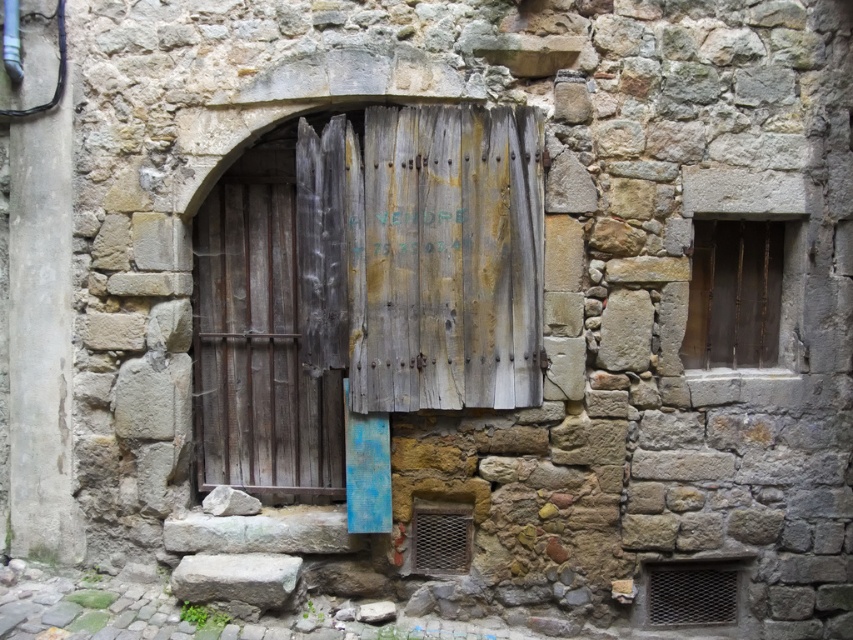
Question: Is wooden bars at right to the right of gray rough stone at lower left from the viewer's perspective?

Choices:
 (A) no
 (B) yes

Answer: (B)

Question: Is weathered wood door at center thinner than wooden bars at right?

Choices:
 (A) no
 (B) yes

Answer: (A)

Question: Is weathered wood shutter at center smaller than wooden bars at right?

Choices:
 (A) yes
 (B) no

Answer: (B)

Question: Which of the following is the closest to the observer?

Choices:
 (A) (727, 576)
 (B) (207, 579)
 (C) (751, 336)
 (D) (410, 257)

Answer: (D)

Question: Among these points, which one is nearest to the camera?

Choices:
 (A) (416, 204)
 (B) (267, 596)
 (C) (305, 497)

Answer: (A)

Question: Among these objects, which one is farthest from the camera?

Choices:
 (A) metal mesh vent at lower right
 (B) gray rough stone at lower left
 (C) wooden bars at right
 (D) weathered wood shutter at center

Answer: (A)